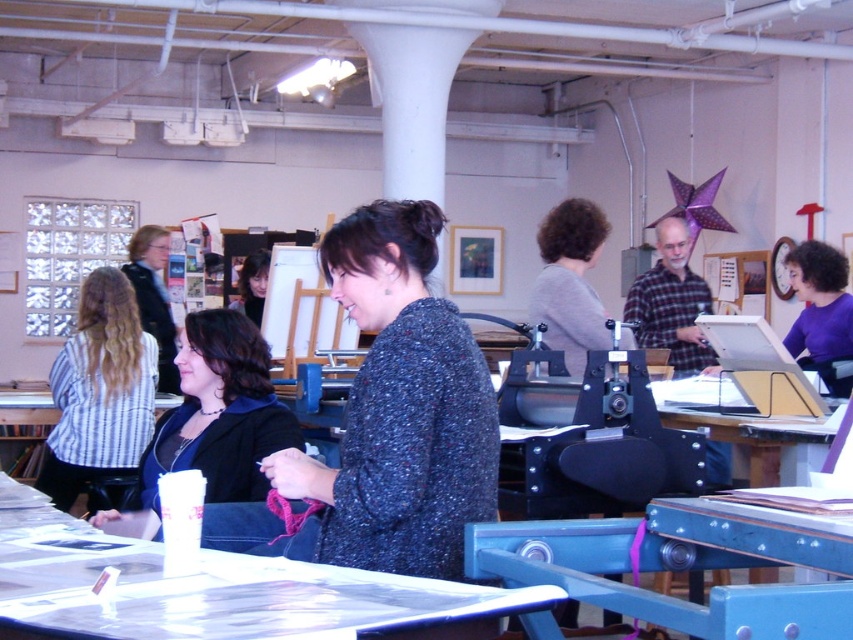
Question: Which of the following is the farthest from the observer?

Choices:
 (A) matte black jacket at center
 (B) gray sweater at center
 (C) speckled wool sweater at center
 (D) matte black hair at center

Answer: (D)

Question: Which point is farther to the camera?

Choices:
 (A) (164, 419)
 (B) (309, 593)
 (C) (405, 301)

Answer: (A)

Question: Does speckled wool sweater at center have a greater width compared to purple matte shirt at right?

Choices:
 (A) yes
 (B) no

Answer: (A)

Question: Which object appears closest to the camera in this image?

Choices:
 (A) matte black jacket at center
 (B) gray sweater at center
 (C) purple matte shirt at right
 (D) white glossy table at lower center

Answer: (D)

Question: Is white glossy table at lower center above striped fabric shirt at left?

Choices:
 (A) no
 (B) yes

Answer: (A)

Question: Does white glossy table at lower center appear over matte black jacket at center?

Choices:
 (A) no
 (B) yes

Answer: (A)